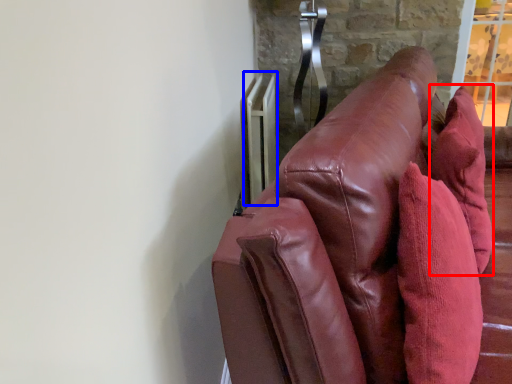
Question: Which object is further to the camera taking this photo, throw pillow (highlighted by a red box) or radiator (highlighted by a blue box)?

Choices:
 (A) throw pillow
 (B) radiator

Answer: (B)